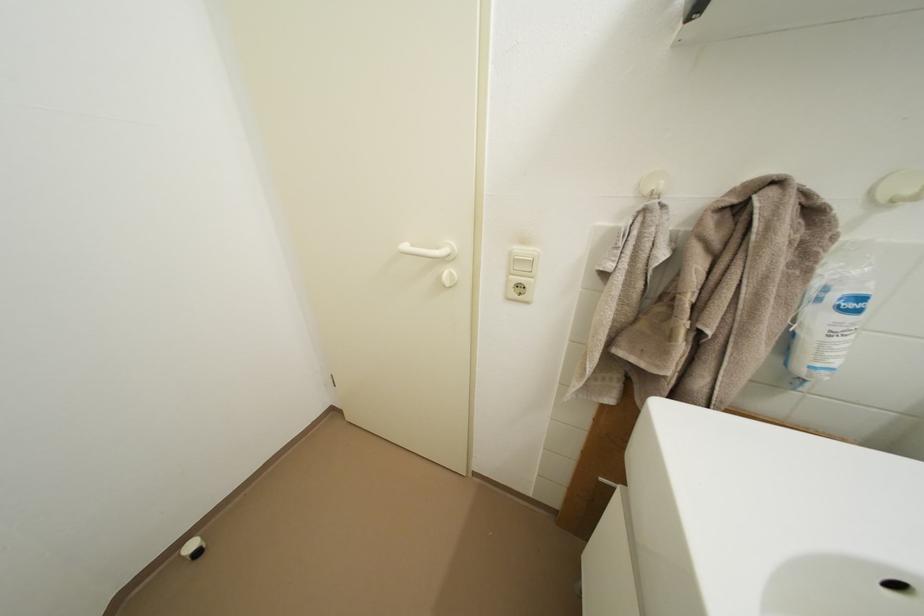
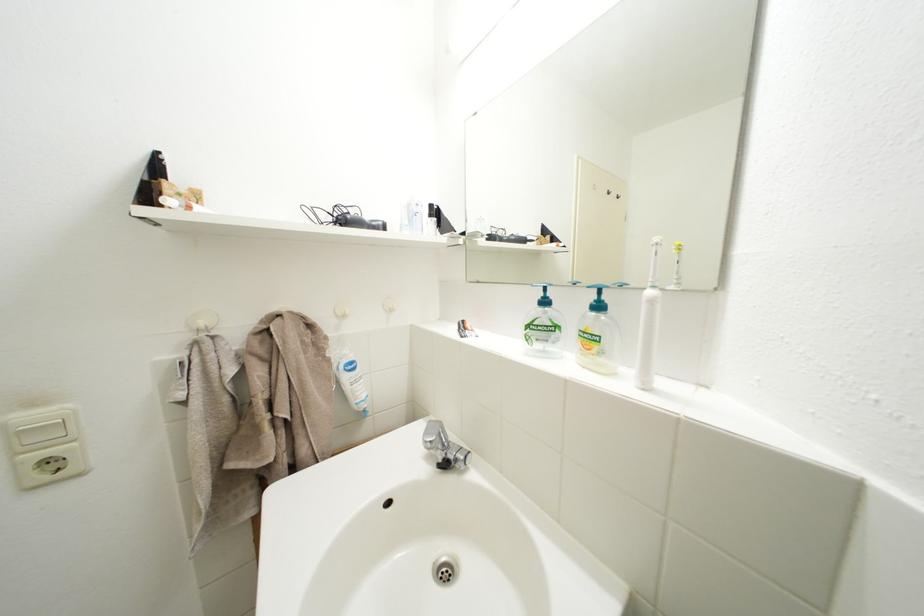
The point at (670, 191) is marked in the first image. Where is the corresponding point in the second image?

(211, 329)